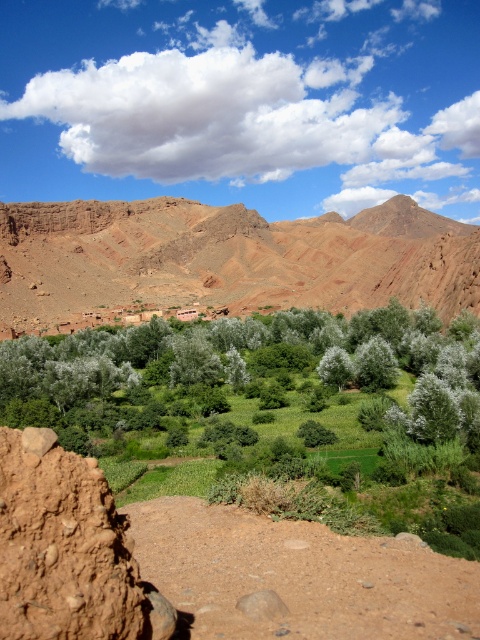
Question: Does brown rocky mountain at center have a smaller size compared to green leafy trees at center?

Choices:
 (A) no
 (B) yes

Answer: (A)

Question: Observing the image, what is the correct spatial positioning of brown rocky mountain at center in reference to green leafy trees at center?

Choices:
 (A) right
 (B) left

Answer: (A)

Question: Which of the following is the farthest from the observer?

Choices:
 (A) (204, 280)
 (B) (87, 378)

Answer: (A)

Question: Which object appears farthest from the camera in this image?

Choices:
 (A) brown rocky mountain at center
 (B) green leafy trees at center

Answer: (A)

Question: Does brown rocky mountain at center have a lesser width compared to green leafy trees at center?

Choices:
 (A) yes
 (B) no

Answer: (B)